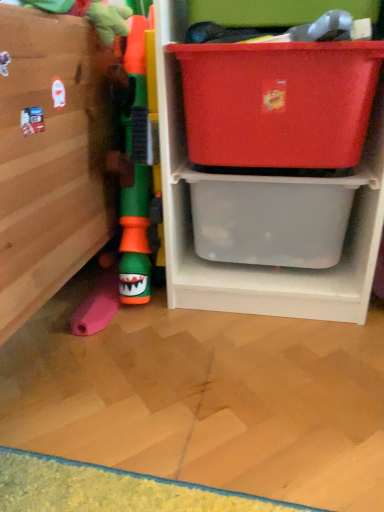
Question: Which is correct: green rubber toy at left is inside transparent plastic storage box at lower right, the 1th storage box positioned from the bottom, or outside of it?

Choices:
 (A) outside
 (B) inside

Answer: (A)

Question: Is green rubber toy at left in front of or behind transparent plastic storage box at lower right, the 1th storage box positioned from the bottom, in the image?

Choices:
 (A) behind
 (B) front

Answer: (B)

Question: Estimate the real-world distances between objects in this image. Which object is farther from the green rubber toy at left?

Choices:
 (A) translucent plastic storage at center
 (B) transparent plastic storage box at lower right, the 1th storage box positioned from the bottom
 (C) matte plastic storage box at upper right, the 2th storage box in the bottom-to-top sequence

Answer: (B)

Question: Estimate the real-world distances between objects in this image. Which object is farther from the translucent plastic storage at center?

Choices:
 (A) matte plastic storage box at upper right, placed as the first storage box when sorted from top to bottom
 (B) green rubber toy at left
 (C) transparent plastic storage box at lower right, the 1th storage box positioned from the bottom

Answer: (B)